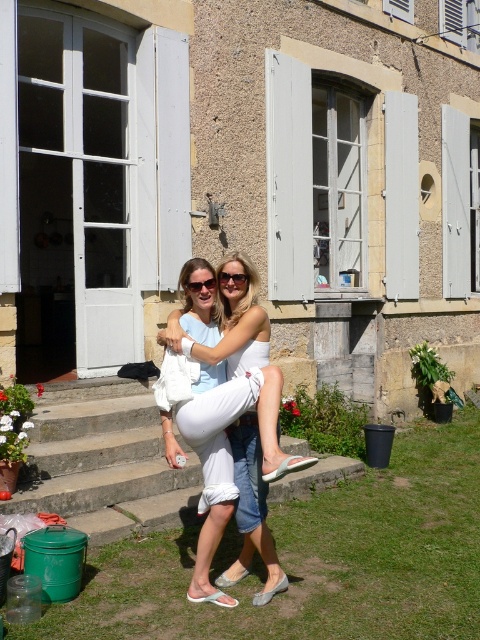
Based on the photo, between white cotton shorts at center and matte white sunglasses at center, which one is positioned lower?

white cotton shorts at center

Can you confirm if white cotton shorts at center is positioned to the right of matte white sunglasses at center?

Indeed, white cotton shorts at center is positioned on the right side of matte white sunglasses at center.

Is point (251, 314) positioned before point (237, 280)?

Yes.

Locate an element on the screen. This screenshot has height=640, width=480. white cotton shorts at center is located at coordinates (241, 403).

Is point (203, 355) more distant than point (192, 284)?

That is False.

Is white cotton shorts at center smaller than matte black sunglasses at center?

Incorrect, white cotton shorts at center is not smaller in size than matte black sunglasses at center.

The image size is (480, 640). In order to click on white cotton shorts at center in this screenshot , I will do `click(241, 403)`.

This screenshot has height=640, width=480. Find the location of `white cotton shorts at center`. white cotton shorts at center is located at coordinates (241, 403).

Is matte white sunglasses at center smaller than matte black sunglasses at center?

Yes, matte white sunglasses at center is smaller than matte black sunglasses at center.

Between point (223, 278) and point (194, 291), which one is positioned behind?

Point (223, 278)

This screenshot has width=480, height=640. What are the coordinates of `matte white sunglasses at center` in the screenshot? It's located at (231, 276).